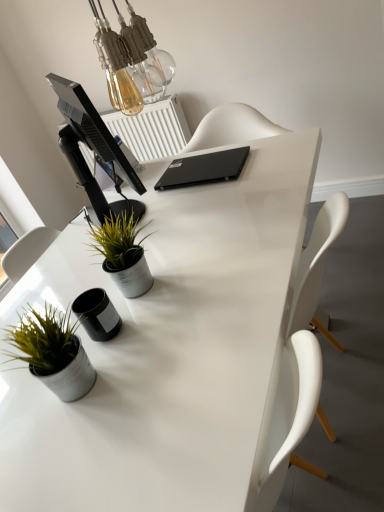
The image size is (384, 512). I want to click on free space in front of matte gray pot at lower left, marked as the 2th houseplant in a back-to-front arrangement, so click(x=78, y=447).